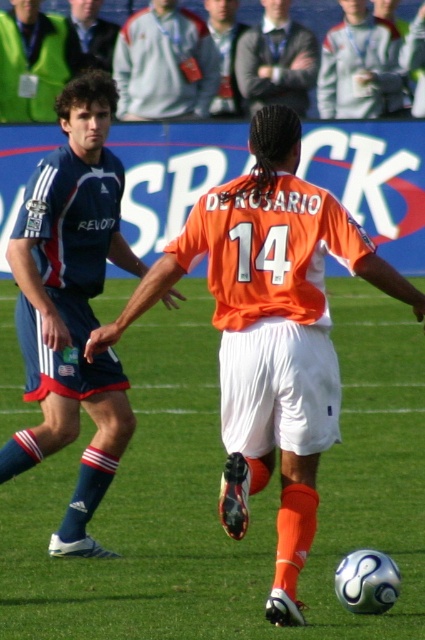
You are a soccer coach analyzing the match. You notice a point at coordinates (217, 496) on the field. What is located at this point?

The point at coordinates (217, 496) indicates green grass at center.

You are a photographer at the soccer match and want to capture both the gray fleece jacket at upper center and the smooth gray suit at upper center in a single frame. Which object should you focus on first to ensure both are in the frame?

The gray fleece jacket at upper center is taller than the smooth gray suit at upper center. To capture both in a single frame, focus on the gray fleece jacket at upper center first, as its greater height will require more space in the composition.